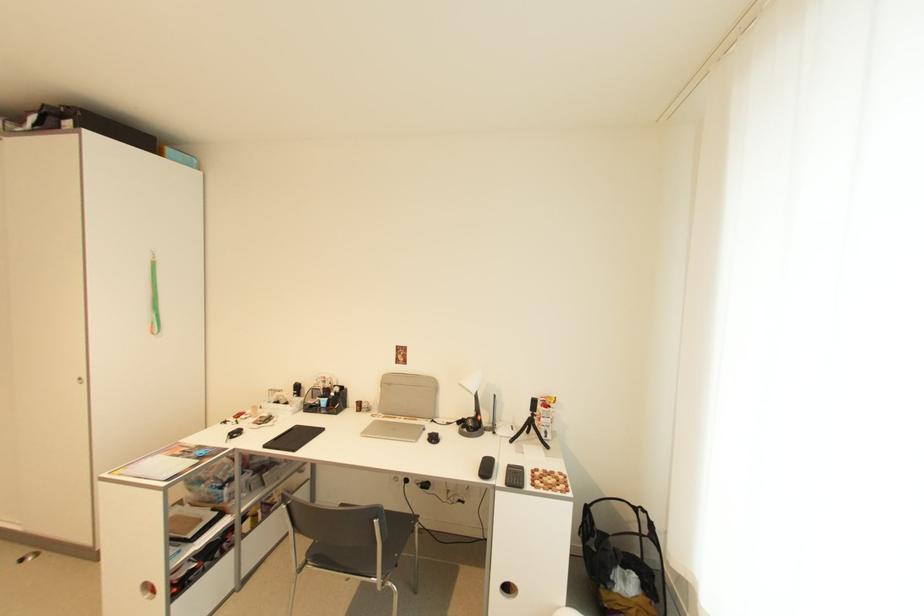
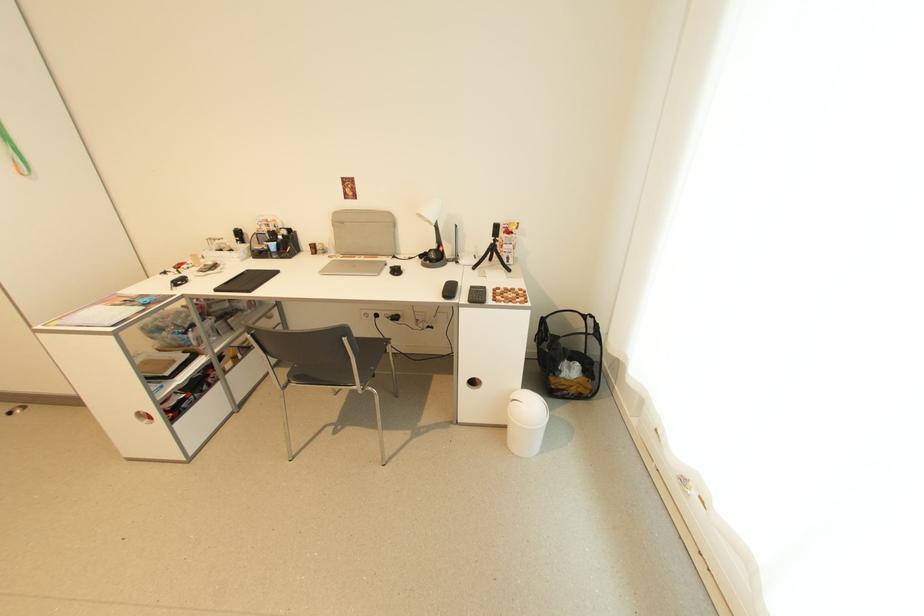
The point at (429, 431) is marked in the first image. Where is the corresponding point in the second image?

(391, 265)